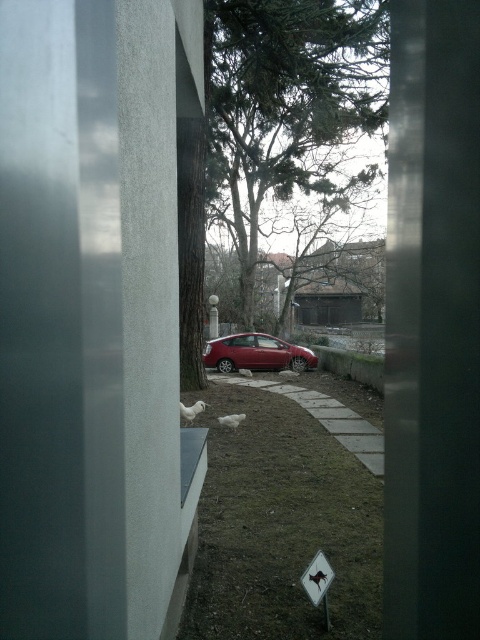
You are standing in front of a window and see the green grass at lower center and the green leafy tree at center. Which object is positioned to the left of the other?

The green grass at lower center is to the left of the green leafy tree at center.

You are standing in front of the window and want to know the exact location of the green grass at lower center. According to the coordinates provided, where is it positioned?

The green grass at lower center is located at point 0.820 on the x axis and 0.585 on the y axis.